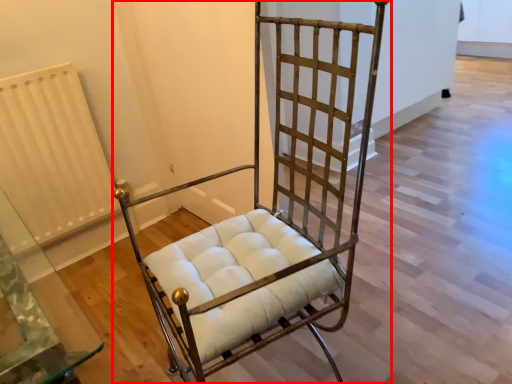
Question: From the image, what is the correct spatial relationship of furniture (annotated by the red box) in relation to radiator?

Choices:
 (A) left
 (B) right

Answer: (B)